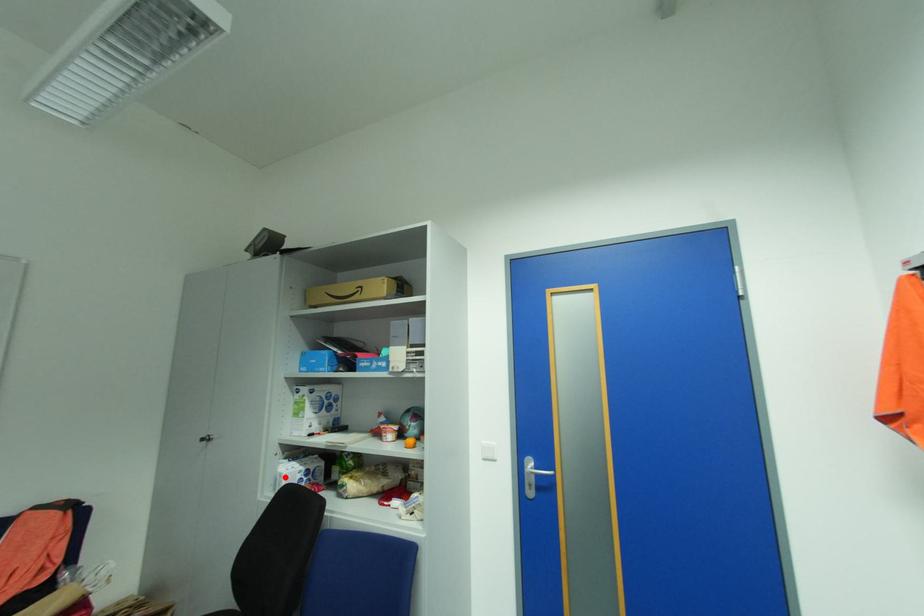
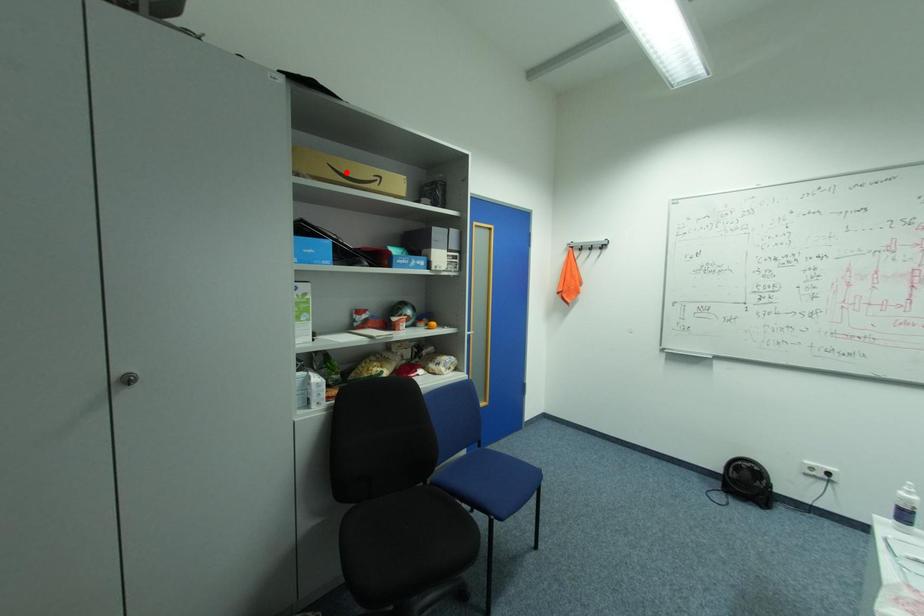
I am providing you with two images of the same scene from different viewpoints. A red point is marked on the first image and another point is marked on the second image. Is the marked point in image1 the same physical position as the marked point in image2?

No